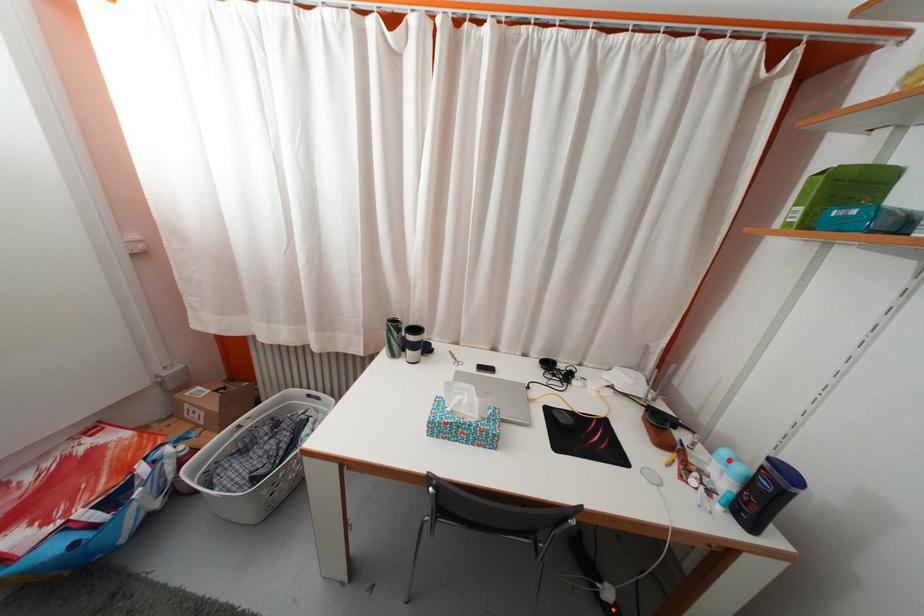
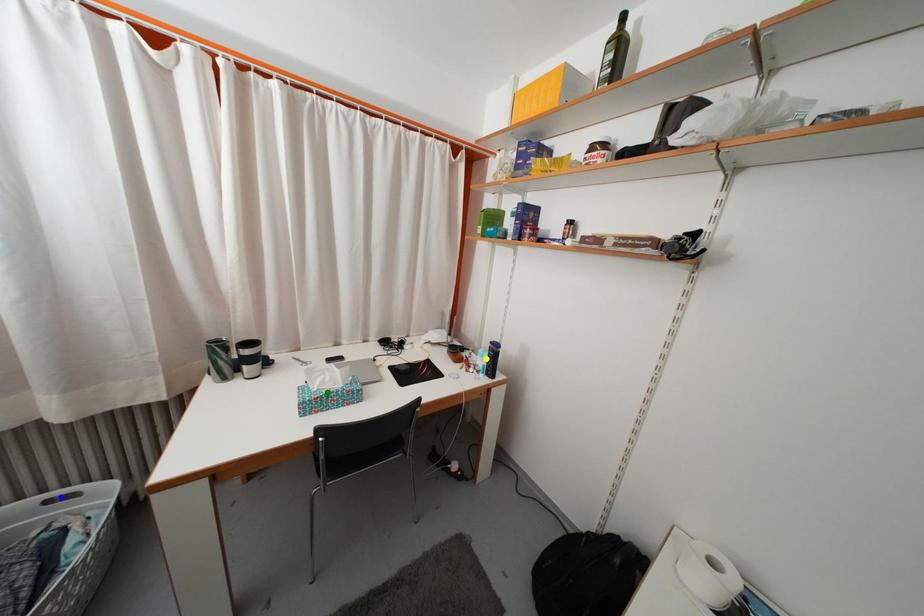
Question: I am providing you with two images of the same scene from different viewpoints. A red point is marked on the first image. You are given multiple points on the second image. Can you choose the point in image 2 that corresponds to the point in image 1?

Choices:
 (A) blue point
 (B) green point
 (C) yellow point

Answer: (C)